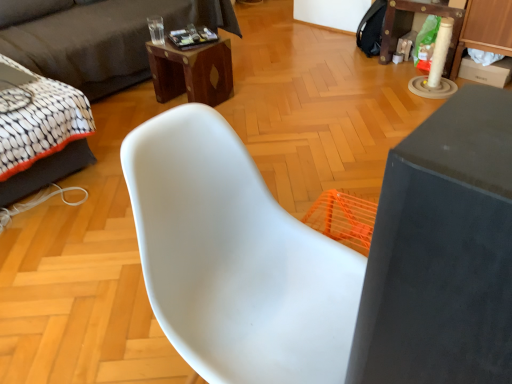
Question: Is white fabric bed at left completely or partially inside wooden table at upper right, the first table positioned from the right?

Choices:
 (A) yes
 (B) no

Answer: (B)

Question: Would you consider wooden table at upper right, which is counted as the 1th table, starting from the back, to be distant from white fabric bed at left?

Choices:
 (A) yes
 (B) no

Answer: (A)

Question: Considering the relative sizes of wooden table at upper right, which is the 1th table from top to bottom, and white fabric bed at left in the image provided, is wooden table at upper right, which is the 1th table from top to bottom, smaller than white fabric bed at left?

Choices:
 (A) no
 (B) yes

Answer: (B)

Question: Considering the relative sizes of wooden table at upper right, which is counted as the 1th table, starting from the back, and white fabric bed at left in the image provided, is wooden table at upper right, which is counted as the 1th table, starting from the back, taller than white fabric bed at left?

Choices:
 (A) yes
 (B) no

Answer: (A)

Question: Can you confirm if wooden table at upper right, placed as the 2th table when sorted from bottom to top, is shorter than white fabric bed at left?

Choices:
 (A) no
 (B) yes

Answer: (A)

Question: From the image's perspective, does wooden table at upper right, the first table positioned from the right, appear lower than white fabric bed at left?

Choices:
 (A) no
 (B) yes

Answer: (A)

Question: Can you confirm if dark gray fabric couch at upper left is shorter than wooden table at upper right, acting as the second table starting from the front?

Choices:
 (A) no
 (B) yes

Answer: (A)

Question: Considering the relative positions of dark gray fabric couch at upper left and wooden table at upper right, which is the 1th table from top to bottom, in the image provided, is dark gray fabric couch at upper left behind wooden table at upper right, which is the 1th table from top to bottom,?

Choices:
 (A) no
 (B) yes

Answer: (A)

Question: Is dark gray fabric couch at upper left completely or partially outside of wooden table at upper right, the second table in the left-to-right sequence?

Choices:
 (A) yes
 (B) no

Answer: (A)

Question: Does dark gray fabric couch at upper left have a greater height compared to wooden table at upper right, placed as the 2th table when sorted from bottom to top?

Choices:
 (A) no
 (B) yes

Answer: (B)

Question: Is dark gray fabric couch at upper left oriented away from wooden table at upper right, placed as the 2th table when sorted from bottom to top?

Choices:
 (A) no
 (B) yes

Answer: (A)

Question: Is dark gray fabric couch at upper left bigger than wooden table at upper right, placed as the 2th table when sorted from bottom to top?

Choices:
 (A) yes
 (B) no

Answer: (A)

Question: Is matte gray table at right, the first table viewed from the left, at the left side of dark gray fabric couch at upper left?

Choices:
 (A) yes
 (B) no

Answer: (B)